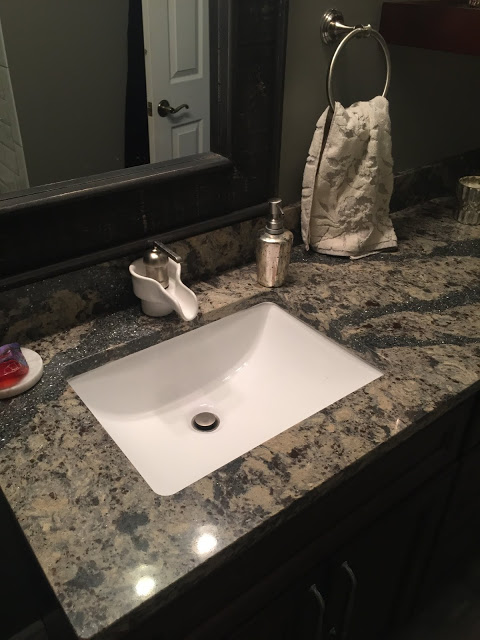
The width and height of the screenshot is (480, 640). I want to click on soap bottle, so click(279, 246).